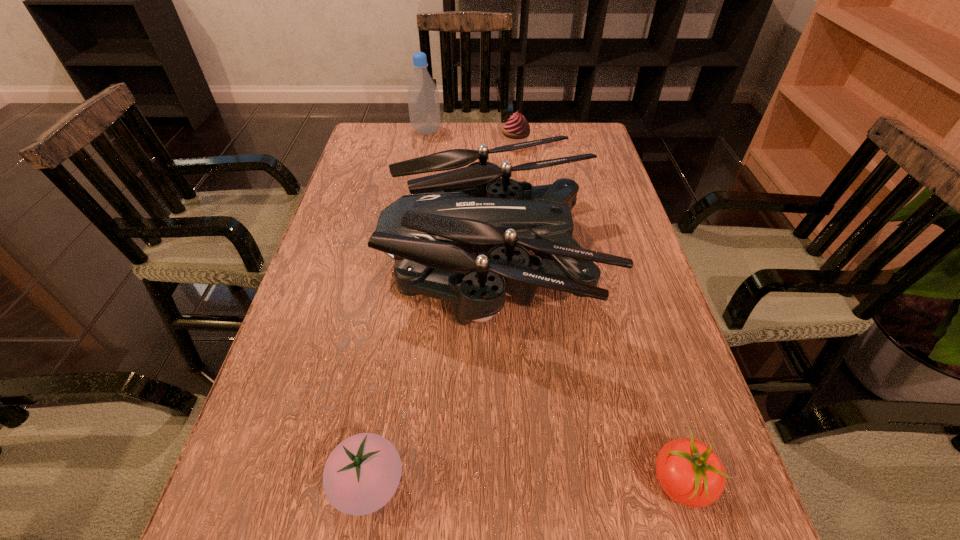
Identify the location of bottle. (423, 96).

Find the location of `the tallest object`. the tallest object is located at coordinates (423, 96).

Locate an element on the screen. Image resolution: width=960 pixels, height=540 pixels. the fourth shortest object is located at coordinates (449, 215).

The width and height of the screenshot is (960, 540). Find the location of `the third farthest object`. the third farthest object is located at coordinates (449, 215).

The image size is (960, 540). I want to click on cupcake, so click(x=516, y=130).

I want to click on the left tomato, so click(x=361, y=475).

Find the location of `the right tomato`. the right tomato is located at coordinates (690, 473).

At what (x,y) coordinates should I click in order to perform the action: click on free space located on the right of the bottle. Please return your answer as a coordinate pair (x, y). The image size is (960, 540). Looking at the image, I should click on (469, 131).

You are a GUI agent. You are given a task and a screenshot of the screen. Output one action in this format:
    pyautogui.click(x=<x>, y=<y>)
    Task: Click on the vacant space located on the back of the drone
    The height and width of the screenshot is (540, 960).
    Given the screenshot: What is the action you would take?
    pyautogui.click(x=489, y=152)

Locate an element on the screen. free space located on the left of the fourth nearest object is located at coordinates (393, 146).